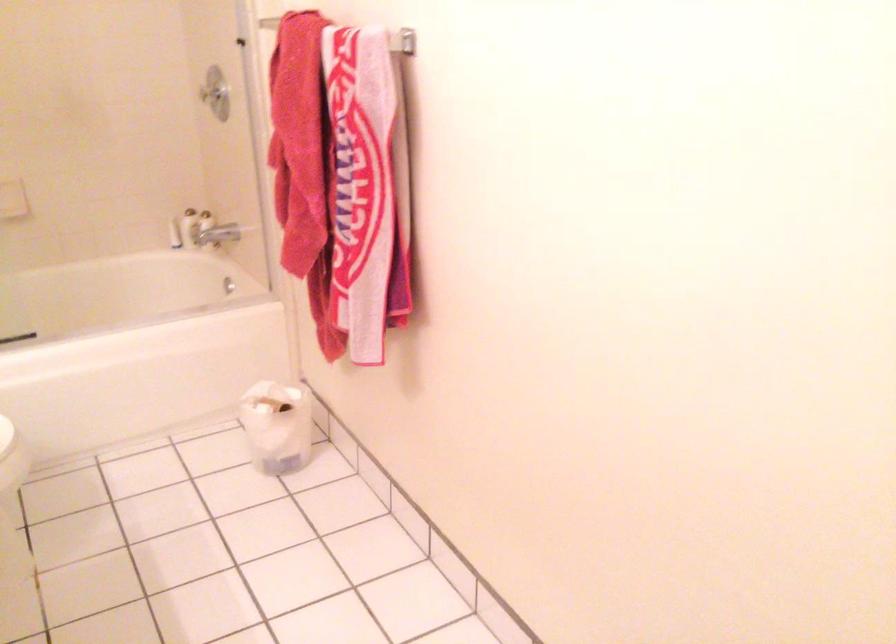
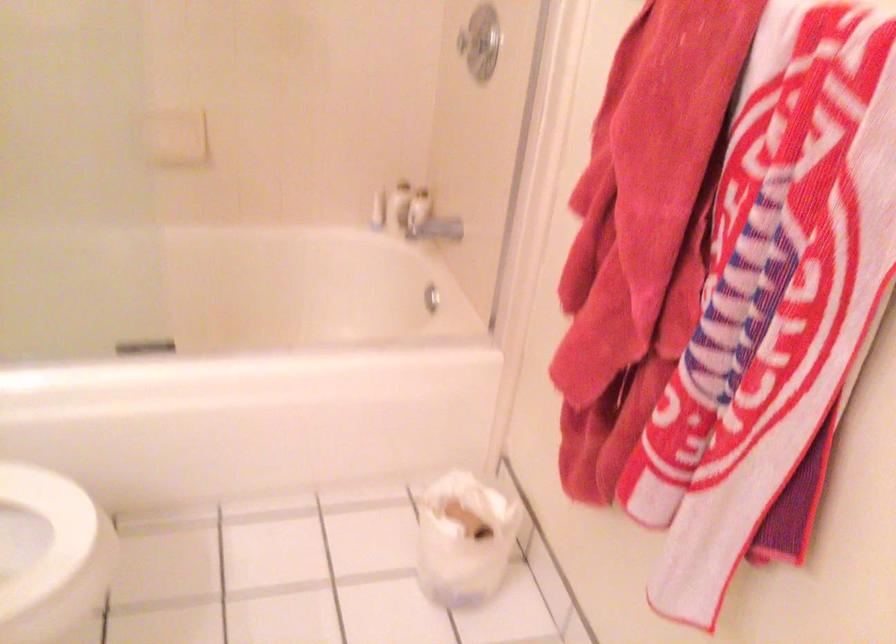
The point at (274, 413) is marked in the first image. Where is the corresponding point in the second image?

(464, 538)